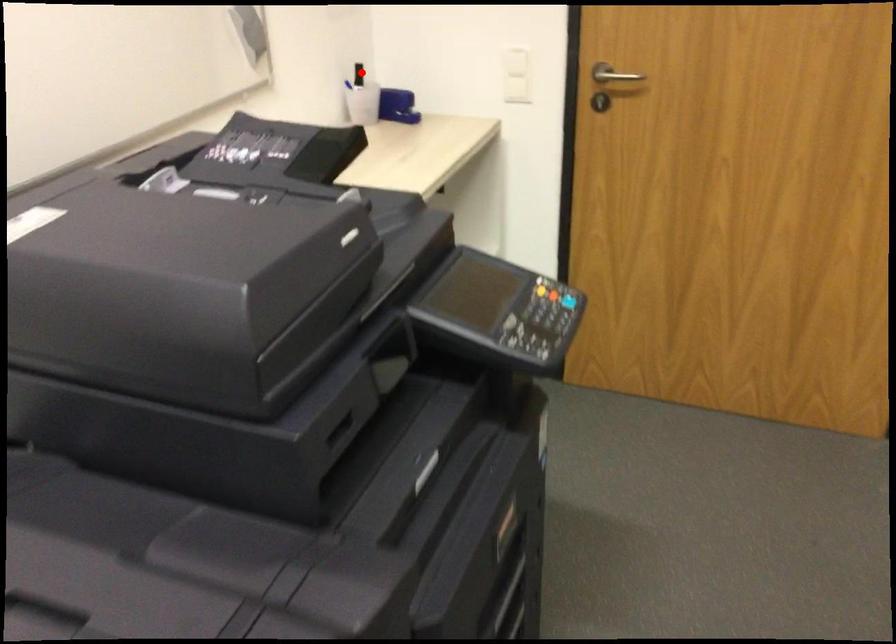
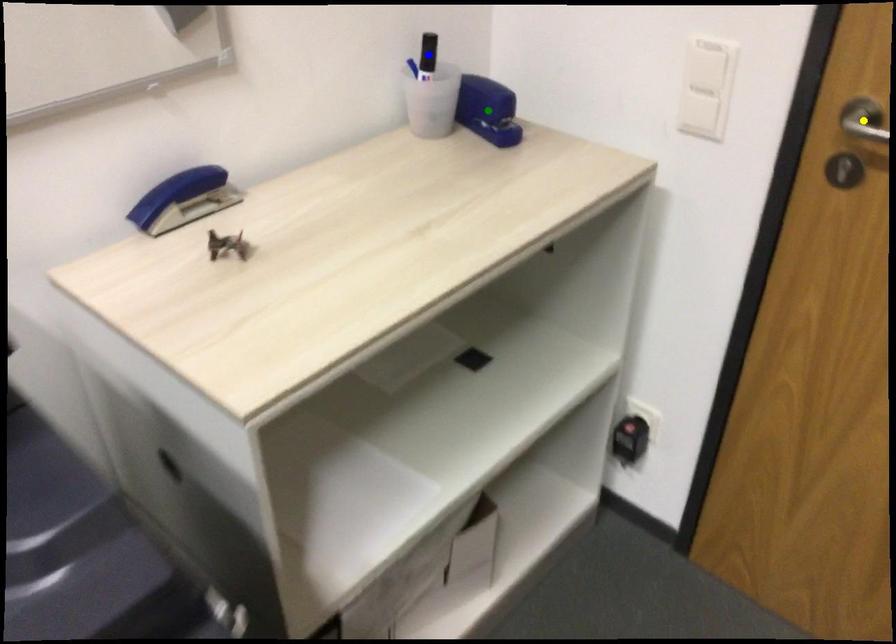
Question: I am providing you with two images of the same scene from different viewpoints. A red point is marked on the first image. You are given multiple points on the second image. Which spot in image 2 lines up with the point in image 1?

Choices:
 (A) green point
 (B) blue point
 (C) yellow point

Answer: (B)